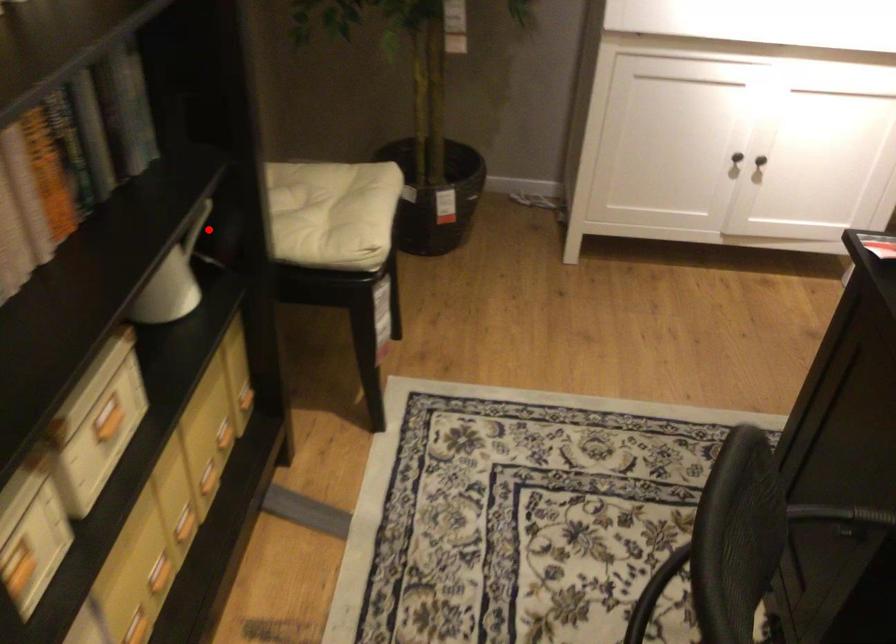
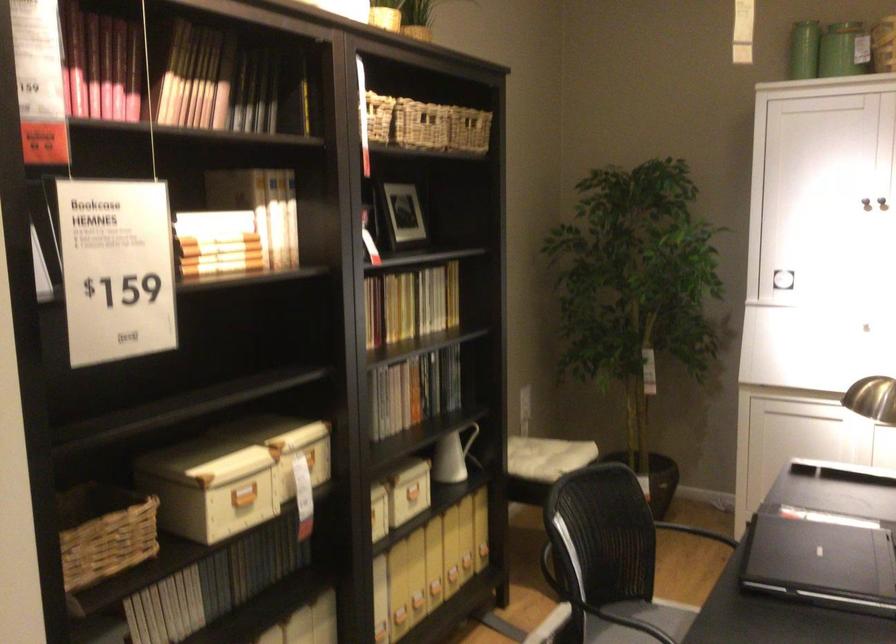
Question: I am providing you with two images of the same scene from different viewpoints. A red point is shown in image1. For the corresponding object point in image2, is it positioned nearer or farther from the camera?

Choices:
 (A) Nearer
 (B) Farther

Answer: (B)